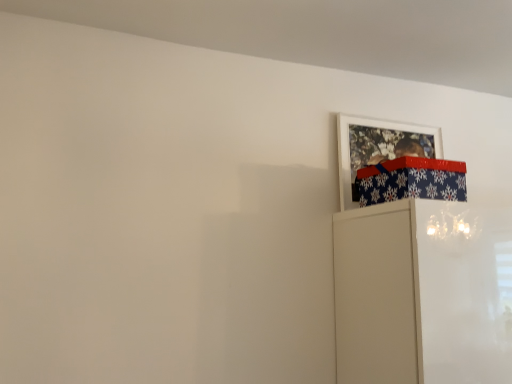
Where is `blue snowflake-patterned wrapping paper at upper right`? blue snowflake-patterned wrapping paper at upper right is located at coordinates pyautogui.click(x=411, y=180).

Describe the element at coordinates (411, 180) in the screenshot. I see `blue snowflake-patterned wrapping paper at upper right` at that location.

Describe the element at coordinates (378, 148) in the screenshot. The height and width of the screenshot is (384, 512). I see `white matte picture frame at upper right` at that location.

What are the coordinates of `white matte picture frame at upper right` in the screenshot? It's located at (378, 148).

In order to face white matte picture frame at upper right, should I rotate leftwards or rightwards?

Turn right approximately 18.069 degrees to face it.

Find the location of a particular element. blue snowflake-patterned wrapping paper at upper right is located at coordinates (411, 180).

Consider the image. Which is more to the right, white matte picture frame at upper right or blue snowflake-patterned wrapping paper at upper right?

Positioned to the right is white matte picture frame at upper right.

Is the position of white matte picture frame at upper right more distant than that of blue snowflake-patterned wrapping paper at upper right?

Yes, it is.

Considering the points (434, 140) and (365, 183), which point is behind, point (434, 140) or point (365, 183)?

The point (434, 140) is farther from the camera.

From the image's perspective, is white matte picture frame at upper right above or below blue snowflake-patterned wrapping paper at upper right?

white matte picture frame at upper right is above blue snowflake-patterned wrapping paper at upper right.

From a real-world perspective, between white matte picture frame at upper right and blue snowflake-patterned wrapping paper at upper right, who is vertically lower?

In real-world perspective, blue snowflake-patterned wrapping paper at upper right is lower.

Is white matte picture frame at upper right wider than blue snowflake-patterned wrapping paper at upper right?

Incorrect, the width of white matte picture frame at upper right does not surpass that of blue snowflake-patterned wrapping paper at upper right.

Considering the relative sizes of white matte picture frame at upper right and blue snowflake-patterned wrapping paper at upper right in the image provided, is white matte picture frame at upper right shorter than blue snowflake-patterned wrapping paper at upper right?

In fact, white matte picture frame at upper right may be taller than blue snowflake-patterned wrapping paper at upper right.

Considering the relative sizes of white matte picture frame at upper right and blue snowflake-patterned wrapping paper at upper right in the image provided, is white matte picture frame at upper right smaller than blue snowflake-patterned wrapping paper at upper right?

Correct, white matte picture frame at upper right occupies less space than blue snowflake-patterned wrapping paper at upper right.

Is blue snowflake-patterned wrapping paper at upper right located within white matte picture frame at upper right?

Actually, blue snowflake-patterned wrapping paper at upper right is outside white matte picture frame at upper right.

Would you consider white matte picture frame at upper right to be distant from blue snowflake-patterned wrapping paper at upper right?

Actually, white matte picture frame at upper right and blue snowflake-patterned wrapping paper at upper right are a little close together.

Is white matte picture frame at upper right facing away from blue snowflake-patterned wrapping paper at upper right?

Yes, white matte picture frame at upper right's orientation is away from blue snowflake-patterned wrapping paper at upper right.

How many degrees apart are the facing directions of white matte picture frame at upper right and blue snowflake-patterned wrapping paper at upper right?

white matte picture frame at upper right and blue snowflake-patterned wrapping paper at upper right are facing 0.00117 degrees away from each other.

Could you measure the distance between white matte picture frame at upper right and blue snowflake-patterned wrapping paper at upper right?

8.51 inches.

Locate an element on the screen. The width and height of the screenshot is (512, 384). wrapping paper to the left of white matte picture frame at upper right is located at coordinates (411, 180).

Can you confirm if blue snowflake-patterned wrapping paper at upper right is positioned to the right of white matte picture frame at upper right?

Incorrect, blue snowflake-patterned wrapping paper at upper right is not on the right side of white matte picture frame at upper right.

Which object is closer to the camera taking this photo, blue snowflake-patterned wrapping paper at upper right or white matte picture frame at upper right?

blue snowflake-patterned wrapping paper at upper right is in front.

Does point (428, 161) appear closer or farther from the camera than point (349, 125)?

Point (428, 161) is closer to the camera than point (349, 125).

From the image's perspective, which is above, blue snowflake-patterned wrapping paper at upper right or white matte picture frame at upper right?

From the image's view, white matte picture frame at upper right is above.

In the scene shown: From a real-world perspective, is blue snowflake-patterned wrapping paper at upper right above or below white matte picture frame at upper right?

blue snowflake-patterned wrapping paper at upper right is situated lower than white matte picture frame at upper right in the real world.

Does blue snowflake-patterned wrapping paper at upper right have a greater width compared to white matte picture frame at upper right?

Yes.

In the scene shown: Which of these two, blue snowflake-patterned wrapping paper at upper right or white matte picture frame at upper right, stands shorter?

Standing shorter between the two is blue snowflake-patterned wrapping paper at upper right.

Looking at this image, which of these two, blue snowflake-patterned wrapping paper at upper right or white matte picture frame at upper right, is smaller?

Smaller between the two is white matte picture frame at upper right.

Based on the photo, choose the correct answer: Is blue snowflake-patterned wrapping paper at upper right inside white matte picture frame at upper right or outside it?

The correct answer is: outside.

Is blue snowflake-patterned wrapping paper at upper right far from white matte picture frame at upper right?

blue snowflake-patterned wrapping paper at upper right is actually quite close to white matte picture frame at upper right.

Based on the photo, is blue snowflake-patterned wrapping paper at upper right looking in the opposite direction of white matte picture frame at upper right?

Correct, blue snowflake-patterned wrapping paper at upper right is looking away from white matte picture frame at upper right.

Can you tell me how much blue snowflake-patterned wrapping paper at upper right and white matte picture frame at upper right differ in facing direction?

0.00117 degrees separate the facing orientations of blue snowflake-patterned wrapping paper at upper right and white matte picture frame at upper right.

How much distance is there between blue snowflake-patterned wrapping paper at upper right and white matte picture frame at upper right?

The distance of blue snowflake-patterned wrapping paper at upper right from white matte picture frame at upper right is 8.51 inches.

I want to click on picture frame to the right of blue snowflake-patterned wrapping paper at upper right, so coord(378,148).

This screenshot has height=384, width=512. In order to click on wrapping paper below the white matte picture frame at upper right (from the image's perspective) in this screenshot , I will do `click(411, 180)`.

Find the location of a particular element. This screenshot has width=512, height=384. picture frame that appears behind the blue snowflake-patterned wrapping paper at upper right is located at coordinates [x=378, y=148].